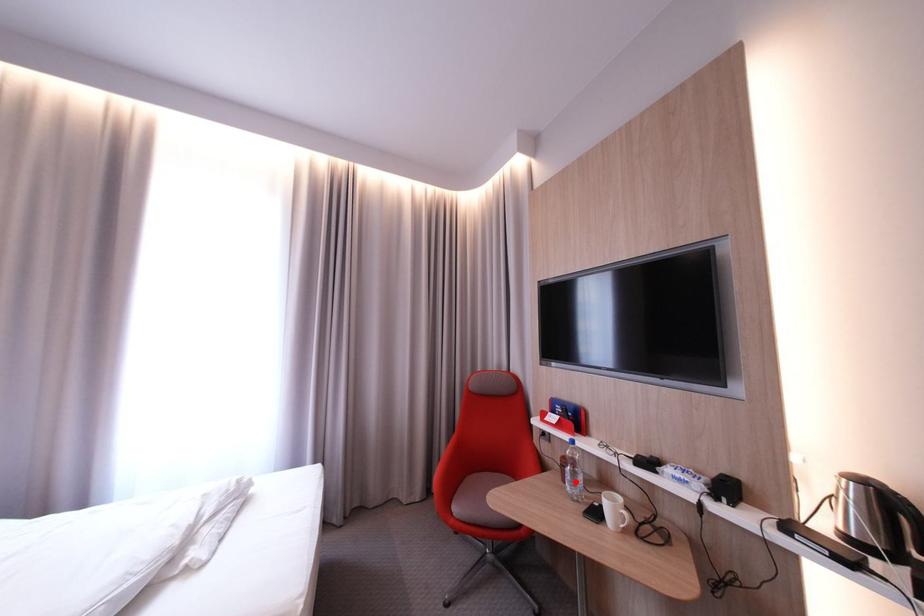
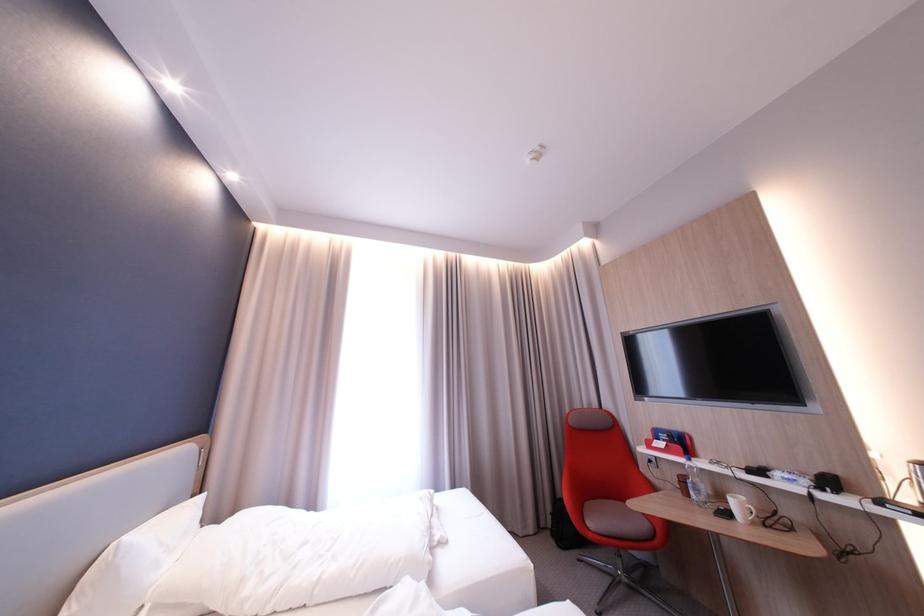
Locate, in the second image, the point that corresponds to the highlighted location in the first image.

(698, 495)